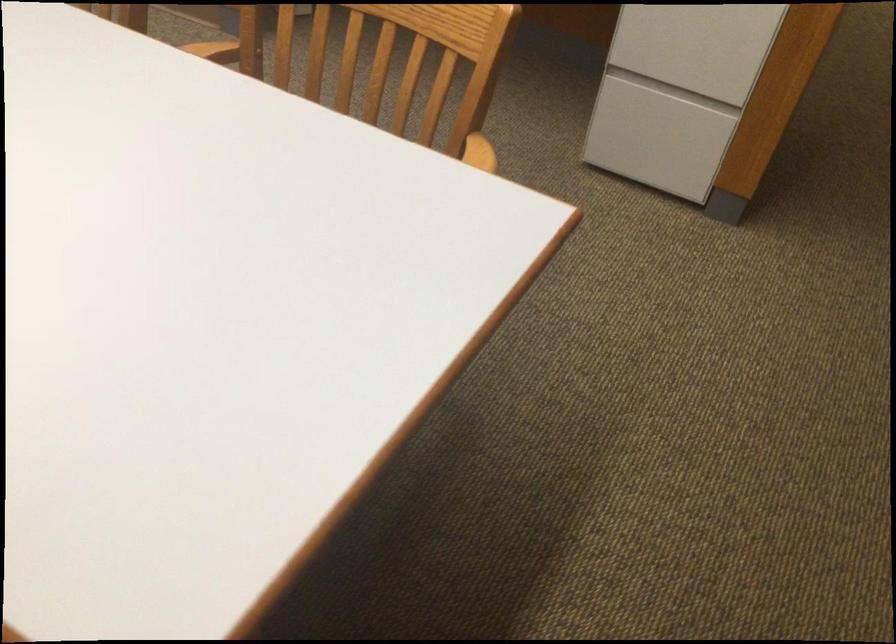
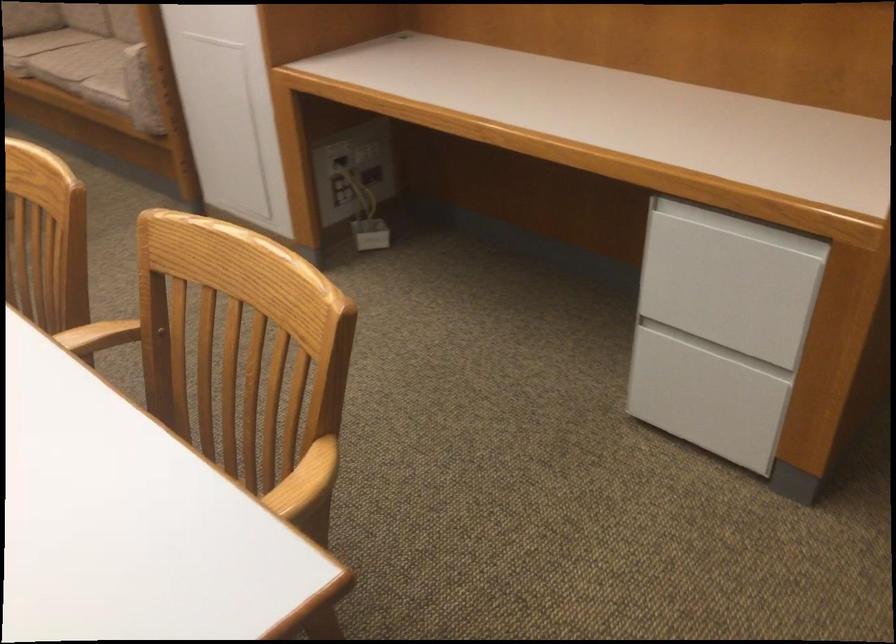
In the second image, find the point that corresponds to point 476,162 in the first image.

(304, 482)